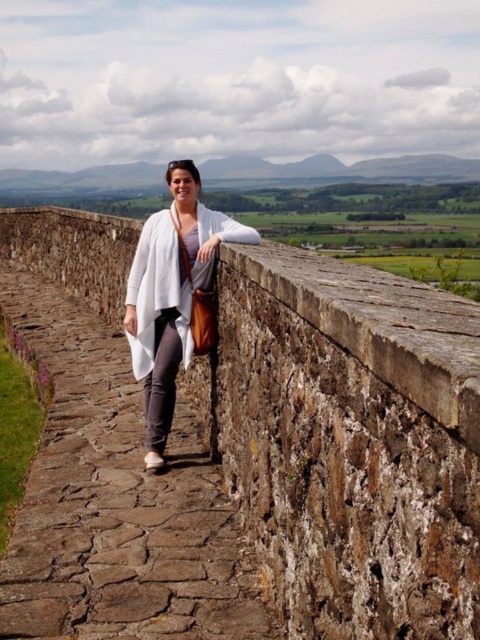
Who is more forward, (x=250, y=401) or (x=172, y=392)?

Point (x=250, y=401) is more forward.

Does brown stone wall at center have a greater height compared to white matte cardigan at center?

Indeed, brown stone wall at center has a greater height compared to white matte cardigan at center.

Image resolution: width=480 pixels, height=640 pixels. What are the coordinates of `brown stone wall at center` in the screenshot? It's located at (349, 442).